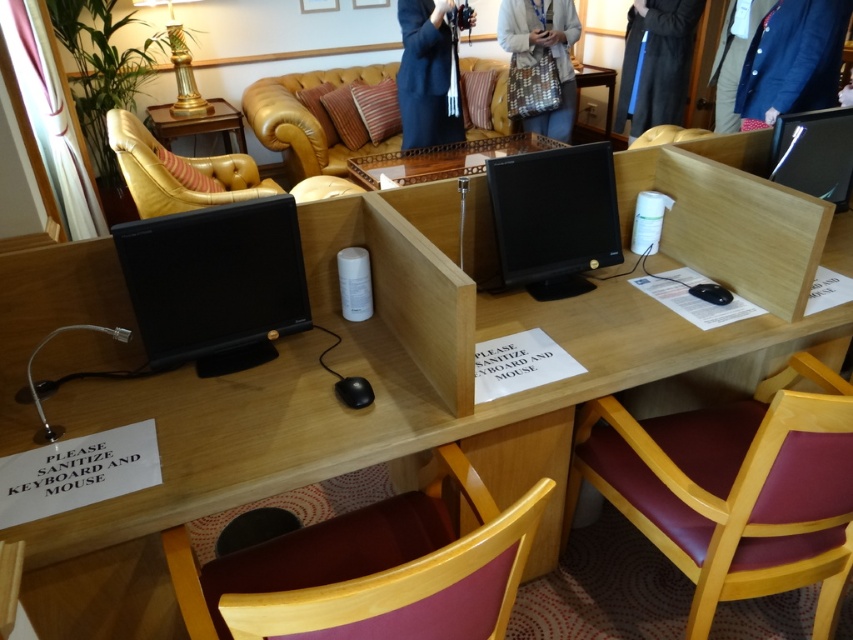
You are standing at the entrance of the workspace and see the point marked at coordinates (368, 570). What object is located at that point?

The point at coordinates (368, 570) marks the purple fabric chair at lower center.